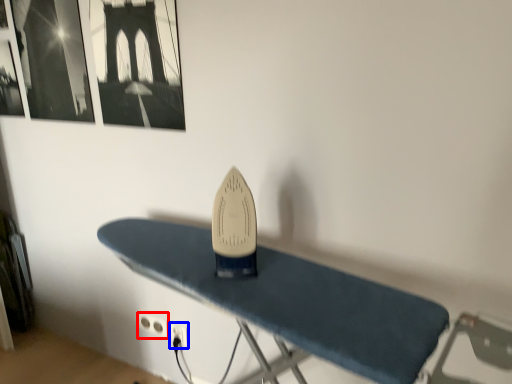
Question: Among these objects, which one is nearest to the camera, plug (highlighted by a red box) or plug (highlighted by a blue box)?

Choices:
 (A) plug
 (B) plug

Answer: (B)